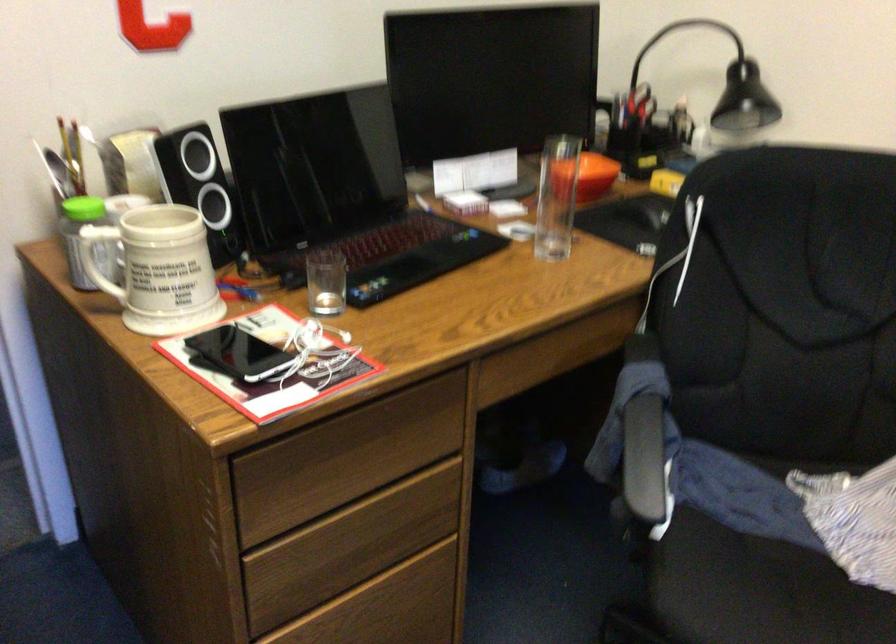
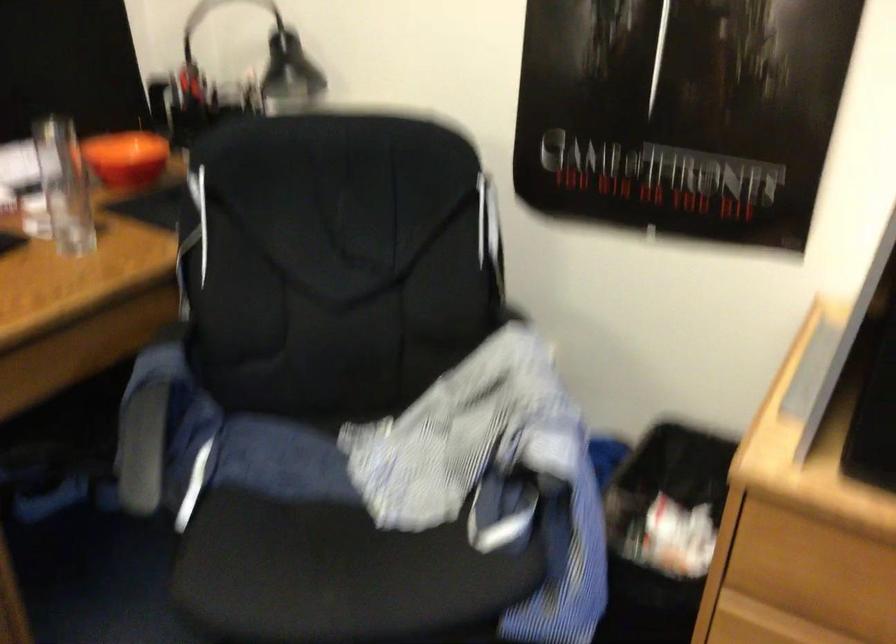
Question: I am providing you with two images of the same scene from different viewpoints. Please identify which objects are invisible in image2.

Choices:
 (A) black computer mouse
 (B) red round magnet
 (C) black desk lamp
 (D) tall clear glass

Answer: (A)